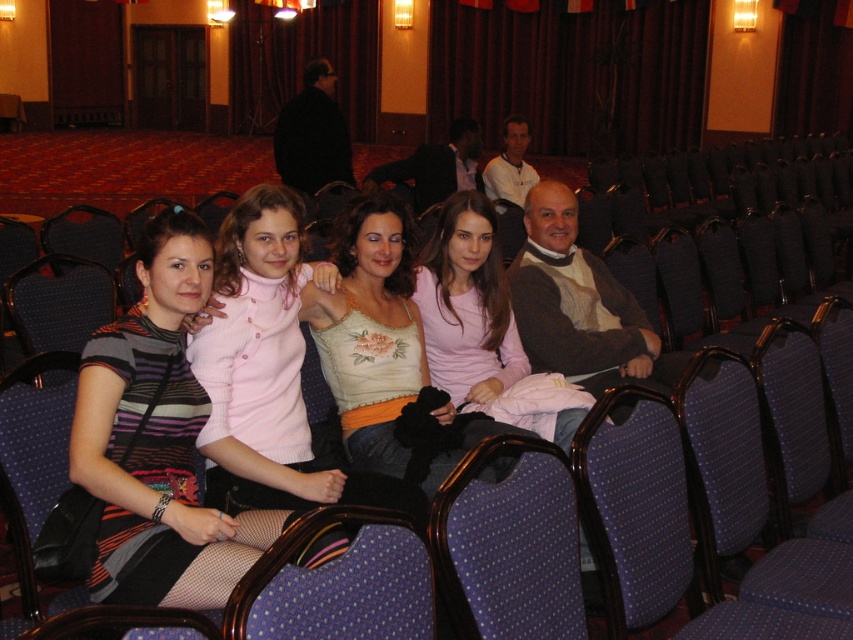
Who is positioned more to the right, pink knitted sweater at center or matte floral tank top at center?

matte floral tank top at center

Can you confirm if pink knitted sweater at center is taller than matte floral tank top at center?

Incorrect, pink knitted sweater at center's height is not larger of matte floral tank top at center's.

Is point (245, 195) positioned after point (366, 308)?

No.

I want to click on pink knitted sweater at center, so click(260, 349).

Which is in front, point (276, 481) or point (560, 636)?

Point (560, 636)

Which is above, pink knitted sweater at center or blue dotted fabric chair at center?

pink knitted sweater at center is above.

Locate an element on the screen. pink knitted sweater at center is located at coordinates (260, 349).

Which is behind, point (252, 435) or point (502, 300)?

The point (502, 300) is behind.

Is point (248, 312) more distant than point (500, 284)?

That is False.

Identify the location of pink knitted sweater at center. The height and width of the screenshot is (640, 853). (260, 349).